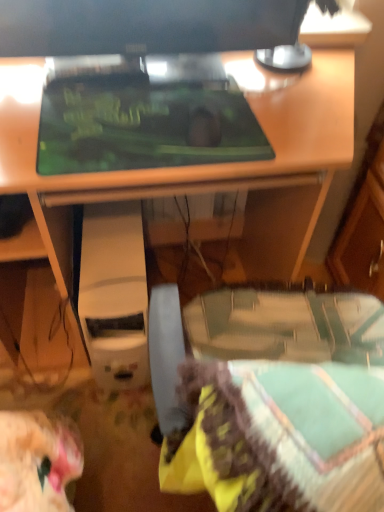
Question: Should I look upward or downward to see matte black desk at center?

Choices:
 (A) down
 (B) up

Answer: (B)

Question: Considering the relative sizes of matte black monitor at upper center and white plastic computer at center in the image provided, is matte black monitor at upper center bigger than white plastic computer at center?

Choices:
 (A) no
 (B) yes

Answer: (A)

Question: Does matte black monitor at upper center have a greater width compared to white plastic computer at center?

Choices:
 (A) yes
 (B) no

Answer: (B)

Question: From a real-world perspective, is matte black monitor at upper center positioned over white plastic computer at center based on gravity?

Choices:
 (A) yes
 (B) no

Answer: (A)

Question: Is matte black monitor at upper center taller than white plastic computer at center?

Choices:
 (A) yes
 (B) no

Answer: (B)

Question: Is matte black monitor at upper center shorter than white plastic computer at center?

Choices:
 (A) yes
 (B) no

Answer: (A)

Question: From a real-world perspective, is matte black monitor at upper center below white plastic computer at center?

Choices:
 (A) no
 (B) yes

Answer: (A)

Question: Is white plastic computer at center smaller than matte black monitor at upper center?

Choices:
 (A) yes
 (B) no

Answer: (B)

Question: From a real-world perspective, is white plastic computer at center physically below matte black monitor at upper center?

Choices:
 (A) yes
 (B) no

Answer: (A)

Question: Does white plastic computer at center appear on the right side of matte black monitor at upper center?

Choices:
 (A) yes
 (B) no

Answer: (B)

Question: Is white plastic computer at center to the left of matte black monitor at upper center from the viewer's perspective?

Choices:
 (A) no
 (B) yes

Answer: (B)

Question: Considering the relative sizes of white plastic computer at center and matte black monitor at upper center in the image provided, is white plastic computer at center bigger than matte black monitor at upper center?

Choices:
 (A) yes
 (B) no

Answer: (A)

Question: Is the depth of white plastic computer at center less than that of matte black monitor at upper center?

Choices:
 (A) no
 (B) yes

Answer: (A)

Question: Is the position of green matte mousepad at center more distant than that of white plastic computer at center?

Choices:
 (A) no
 (B) yes

Answer: (A)